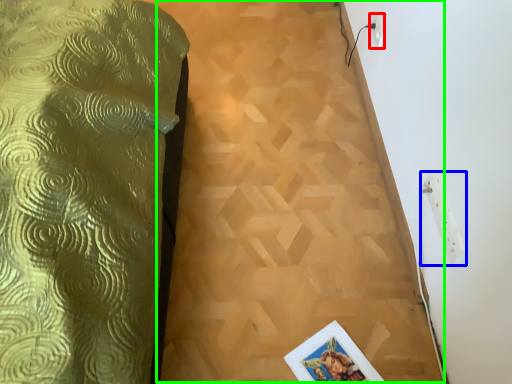
Question: Considering the real-world distances, which object is closest to electric outlet (highlighted by a red box)? electric outlet (highlighted by a blue box) or plywood (highlighted by a green box).

Choices:
 (A) electric outlet
 (B) plywood

Answer: (B)